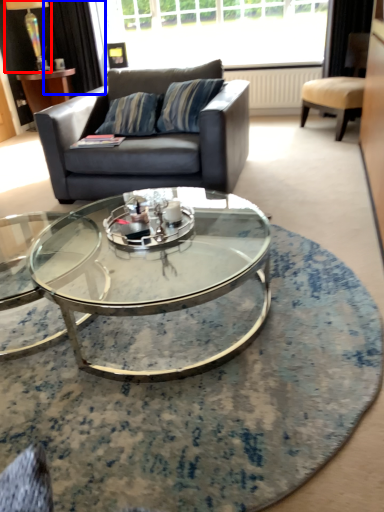
Question: Which object appears closest to the camera in this image, lamp (highlighted by a red box) or curtain (highlighted by a blue box)?

Choices:
 (A) lamp
 (B) curtain

Answer: (A)